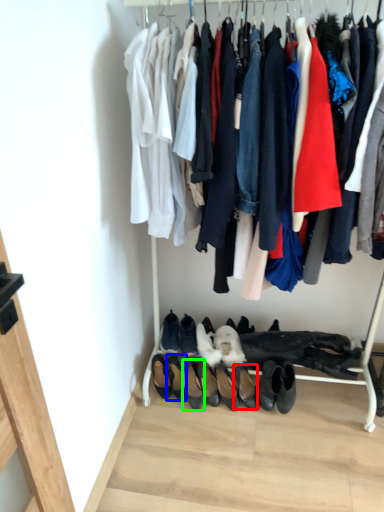
Question: Which object is the farthest from footwear (highlighted by a red box)? Choose among these: footwear (highlighted by a blue box) or footwear (highlighted by a green box).

Choices:
 (A) footwear
 (B) footwear

Answer: (A)